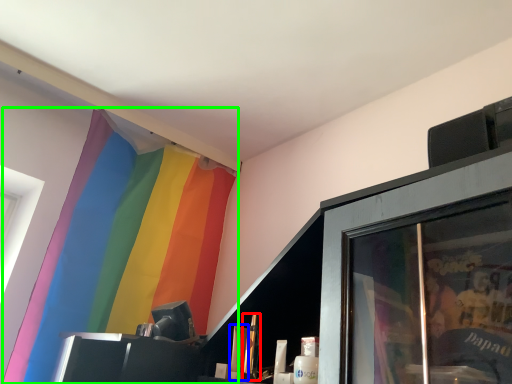
Question: Estimate the real-world distances between objects in this image. Which object is closer to toiletry (highlighted by a red box), toiletry (highlighted by a blue box) or curtain (highlighted by a green box)?

Choices:
 (A) toiletry
 (B) curtain

Answer: (A)